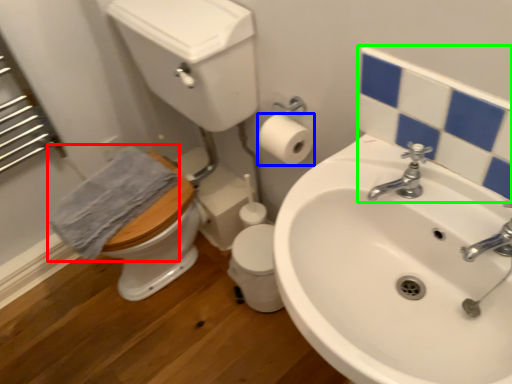
Question: Estimate the real-world distances between objects in this image. Which object is closer to bath towel (highlighted by a red box), toilet paper (highlighted by a blue box) or mirror (highlighted by a green box)?

Choices:
 (A) toilet paper
 (B) mirror

Answer: (A)